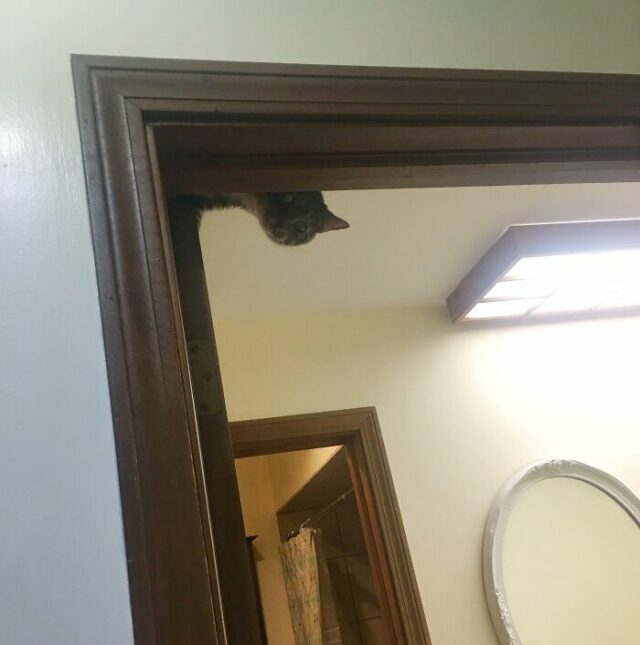
Find the location of `ceiling light`. ceiling light is located at coordinates (603, 288).